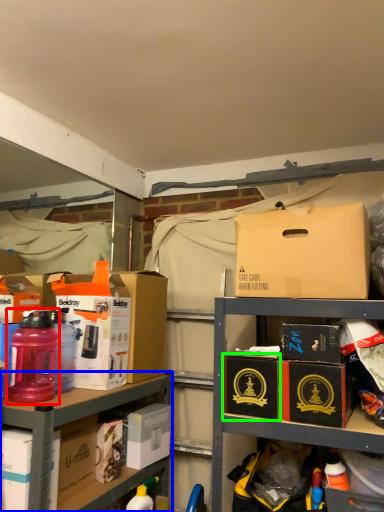
Question: Based on their relative distances, which object is farther from bottle (highlighted by a red box)? Choose from shelf (highlighted by a blue box) and cardboard box (highlighted by a green box).

Choices:
 (A) shelf
 (B) cardboard box

Answer: (B)